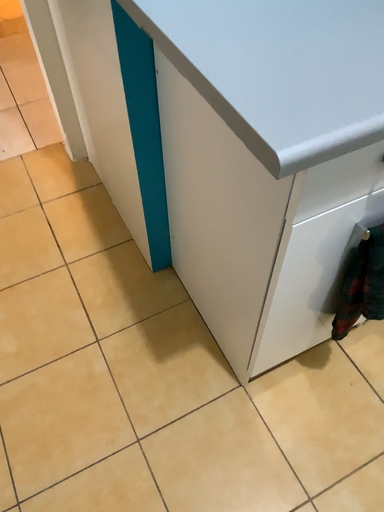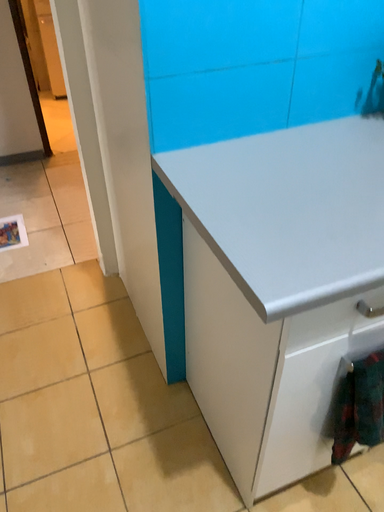
Question: How did the camera likely rotate when shooting the video?

Choices:
 (A) rotated upward
 (B) rotated downward

Answer: (A)